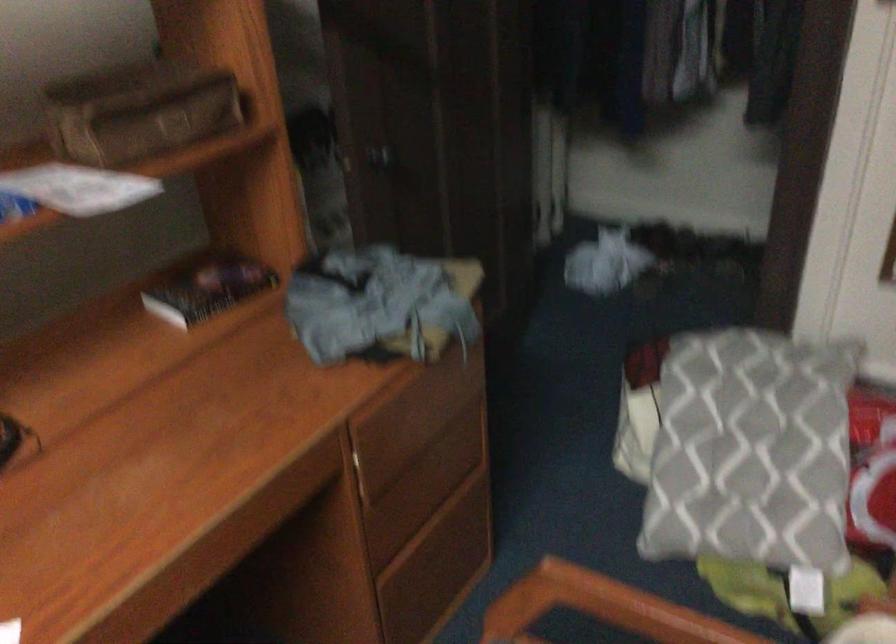
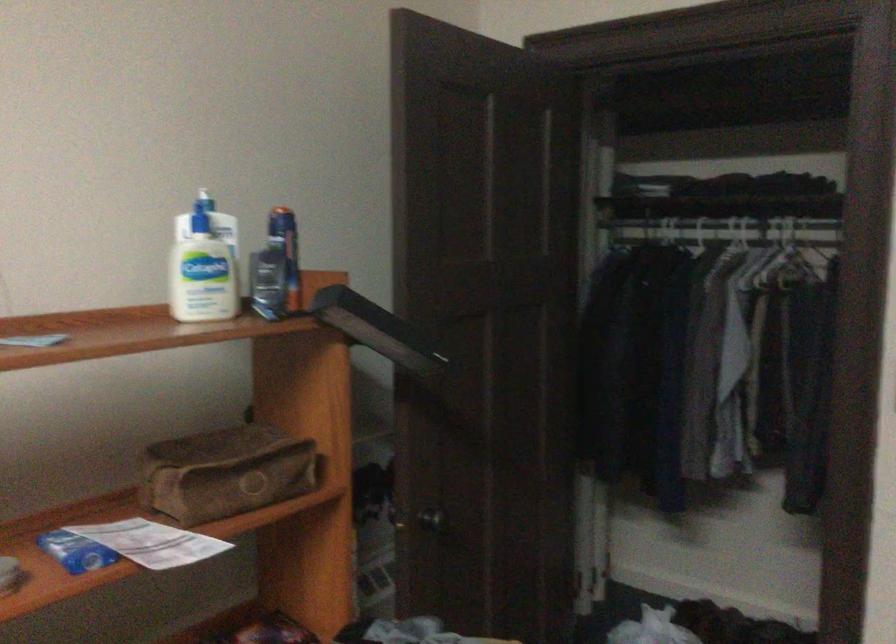
Locate, in the second image, the point that corresponds to (x=317, y=131) in the first image.

(373, 491)